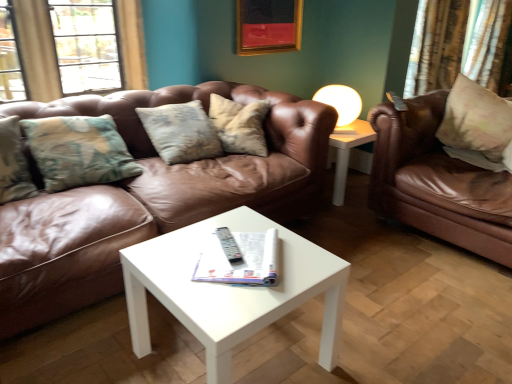
I want to click on free space to the left of black plastic remote at center, so click(x=205, y=247).